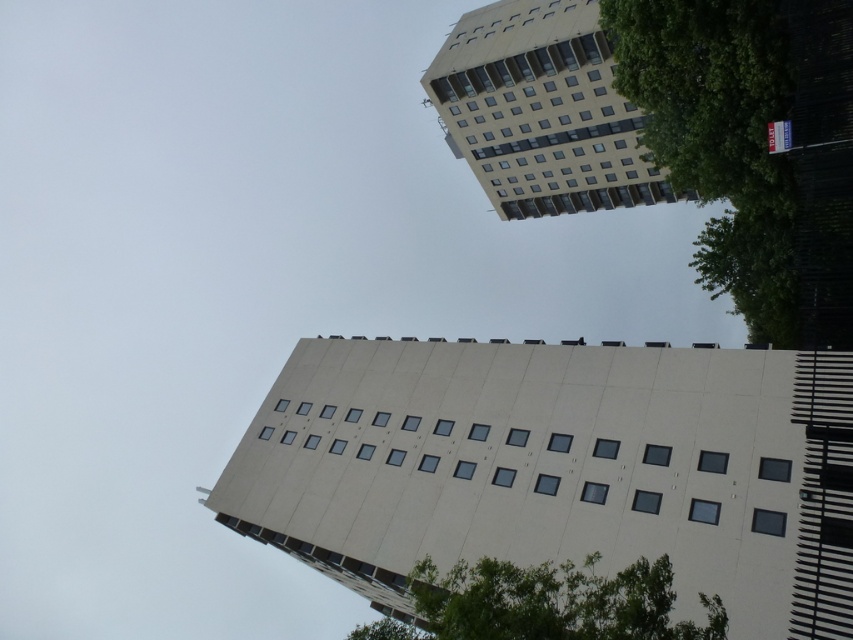
Question: Observing the image, what is the correct spatial positioning of white smooth building at center in reference to green leafy tree at upper right?

Choices:
 (A) left
 (B) right

Answer: (A)

Question: Which point appears closest to the camera in this image?

Choices:
 (A) (637, 515)
 (B) (741, 241)
 (C) (573, 154)

Answer: (A)

Question: Is green leafy tree at upper right positioned at the back of beige concrete building at upper center?

Choices:
 (A) no
 (B) yes

Answer: (A)

Question: Is green leafy tree at upper right positioned at the back of green leafy tree at lower right?

Choices:
 (A) no
 (B) yes

Answer: (B)

Question: Which point appears closest to the camera in this image?

Choices:
 (A) (302, 532)
 (B) (552, 625)
 (C) (639, 40)

Answer: (B)

Question: Which of the following is the farthest from the observer?

Choices:
 (A) (738, 180)
 (B) (314, 476)
 (C) (583, 588)

Answer: (B)